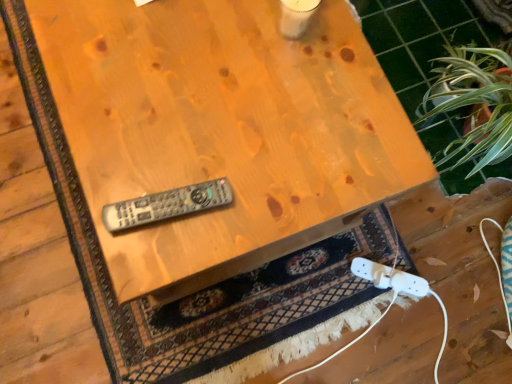
Where is `vacant area that is in front of gray plastic remote at center`? The height and width of the screenshot is (384, 512). vacant area that is in front of gray plastic remote at center is located at coordinates (148, 254).